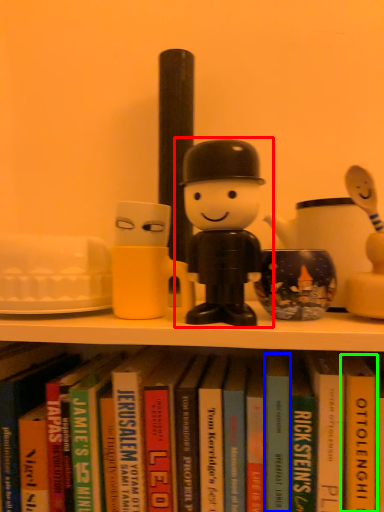
Question: Considering the real-world distances, which object is farthest from toy (highlighted by a red box)? paperback book (highlighted by a blue box) or paperback book (highlighted by a green box)?

Choices:
 (A) paperback book
 (B) paperback book

Answer: (B)